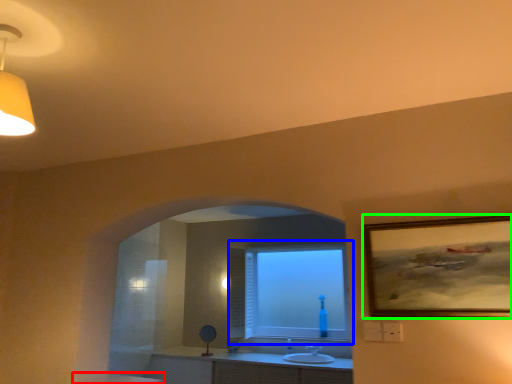
Question: Which object is the farthest from counter top (highlighted by a red box)? Choose among these: window (highlighted by a blue box) or picture frame (highlighted by a green box).

Choices:
 (A) window
 (B) picture frame

Answer: (B)